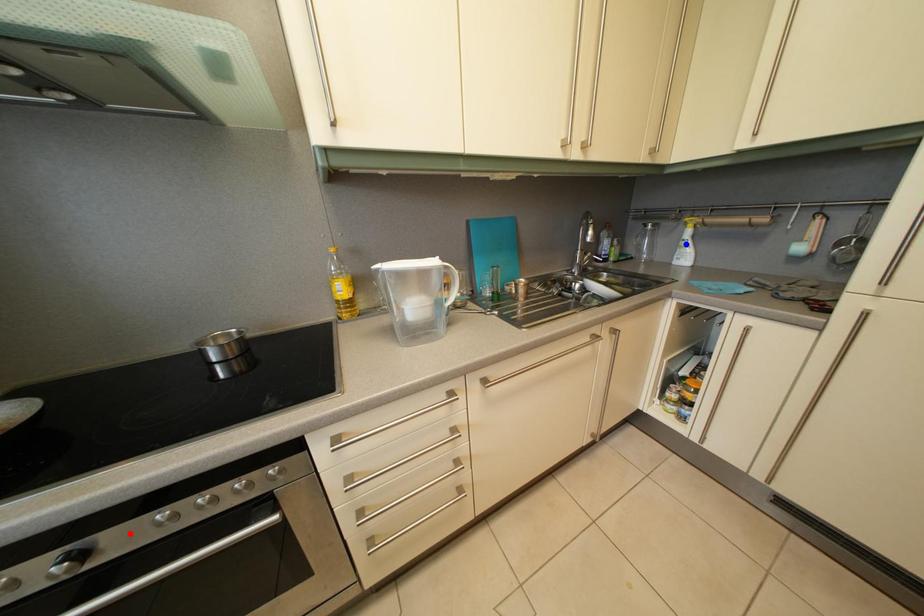
Question: In the image, two points are highlighted. Which point is nearer to the camera? Reply with the corresponding letter.

Choices:
 (A) blue point
 (B) red point

Answer: (B)